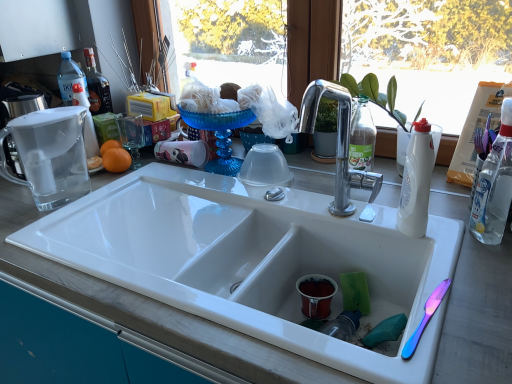
The height and width of the screenshot is (384, 512). In order to click on free location in front of white plastic bottle at right, the second bottle when ordered from right to left in this screenshot , I will do `click(458, 273)`.